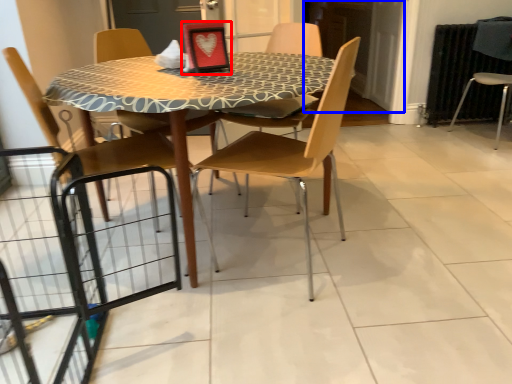
Question: Which object appears farthest to the camera in this image, picture frame (highlighted by a red box) or screen door (highlighted by a blue box)?

Choices:
 (A) picture frame
 (B) screen door

Answer: (B)